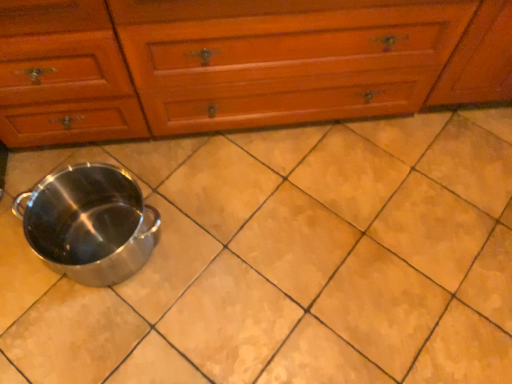
What do you see at coordinates (239, 63) in the screenshot?
I see `wooden chest of drawers at center` at bounding box center [239, 63].

I want to click on matte ceramic tile at center, so click(x=285, y=260).

Measure the distance between matte ceramic tile at center and camera.

matte ceramic tile at center and camera are 3.64 feet apart from each other.

You are a GUI agent. You are given a task and a screenshot of the screen. Output one action in this format:
    pyautogui.click(x=<x>, y=<y>)
    Task: Click on the satin silver crock pot at lower left
    Image resolution: width=512 pixels, height=384 pixels.
    Given the screenshot: What is the action you would take?
    pyautogui.click(x=89, y=223)

In order to click on wooden chest of drawers at center in this screenshot , I will do click(239, 63).

Where is `ceramic tile that is behind the satin silver crock pot at lower left`? This screenshot has width=512, height=384. ceramic tile that is behind the satin silver crock pot at lower left is located at coordinates (285, 260).

Considering their positions, is satin silver crock pot at lower left located in front of or behind matte ceramic tile at center?

satin silver crock pot at lower left is in front of matte ceramic tile at center.

Is satin silver crock pot at lower left touching matte ceramic tile at center?

No, satin silver crock pot at lower left is not beside matte ceramic tile at center.

From the image's perspective, is satin silver crock pot at lower left on matte ceramic tile at center?

Indeed, from the image's perspective, satin silver crock pot at lower left is shown above matte ceramic tile at center.

Are matte ceramic tile at center and wooden chest of drawers at center far apart?

Actually, matte ceramic tile at center and wooden chest of drawers at center are a little close together.

Which object is wider, matte ceramic tile at center or wooden chest of drawers at center?

Wider between the two is matte ceramic tile at center.

From the image's perspective, which one is positioned higher, matte ceramic tile at center or wooden chest of drawers at center?

wooden chest of drawers at center.

Consider the image. Measure the distance between matte ceramic tile at center and wooden chest of drawers at center.

matte ceramic tile at center is 15.73 inches from wooden chest of drawers at center.

Looking at this image, is wooden chest of drawers at center outside of matte ceramic tile at center?

Yes, wooden chest of drawers at center is located beyond the bounds of matte ceramic tile at center.

Can you confirm if wooden chest of drawers at center is bigger than matte ceramic tile at center?

Correct, wooden chest of drawers at center is larger in size than matte ceramic tile at center.

Is matte ceramic tile at center at the back of wooden chest of drawers at center?

No, matte ceramic tile at center is not at the back of wooden chest of drawers at center.

The image size is (512, 384). I want to click on ceramic tile that appears on the left of wooden chest of drawers at center, so click(285, 260).

Locate an element on the screen. This screenshot has width=512, height=384. the chest of drawers lying above the satin silver crock pot at lower left (from the image's perspective) is located at coordinates (239, 63).

Based on the photo, can you confirm if wooden chest of drawers at center is bigger than satin silver crock pot at lower left?

Yes.

From a real-world perspective, who is located lower, wooden chest of drawers at center or satin silver crock pot at lower left?

satin silver crock pot at lower left.

From a real-world perspective, is matte ceramic tile at center positioned under satin silver crock pot at lower left based on gravity?

Yes, from a real-world perspective, matte ceramic tile at center is under satin silver crock pot at lower left.

Are matte ceramic tile at center and satin silver crock pot at lower left making contact?

No, matte ceramic tile at center is not with satin silver crock pot at lower left.

From the image's perspective, relative to satin silver crock pot at lower left, is matte ceramic tile at center above or below?

From the image's perspective, matte ceramic tile at center appears below satin silver crock pot at lower left.

Is point (183, 259) farther from camera compared to point (111, 257)?

That is True.

Between satin silver crock pot at lower left and wooden chest of drawers at center, which one has more height?

With more height is wooden chest of drawers at center.

From a real-world perspective, is satin silver crock pot at lower left on wooden chest of drawers at center?

No, from a real-world perspective, satin silver crock pot at lower left is not on top of wooden chest of drawers at center.

Would you say wooden chest of drawers at center is part of satin silver crock pot at lower left's contents?

Definitely not — wooden chest of drawers at center is not inside satin silver crock pot at lower left.

Where is `crock pot above the matte ceramic tile at center (from a real-world perspective)`? crock pot above the matte ceramic tile at center (from a real-world perspective) is located at coordinates pos(89,223).

Image resolution: width=512 pixels, height=384 pixels. In order to click on ceramic tile behind the wooden chest of drawers at center in this screenshot , I will do `click(285, 260)`.

In the scene shown: Looking at the image, which one is located further to wooden chest of drawers at center, satin silver crock pot at lower left or matte ceramic tile at center?

Among the two, matte ceramic tile at center is located further to wooden chest of drawers at center.

Based on their spatial positions, is wooden chest of drawers at center or matte ceramic tile at center closer to satin silver crock pot at lower left?

Based on the image, matte ceramic tile at center appears to be nearer to satin silver crock pot at lower left.

Based on their spatial positions, is satin silver crock pot at lower left or wooden chest of drawers at center closer to matte ceramic tile at center?

The object closer to matte ceramic tile at center is satin silver crock pot at lower left.

Looking at the image, which one is located further to wooden chest of drawers at center, matte ceramic tile at center or satin silver crock pot at lower left?

matte ceramic tile at center lies further to wooden chest of drawers at center than the other object.

Considering their positions, is matte ceramic tile at center positioned closer to satin silver crock pot at lower left than wooden chest of drawers at center?

The object closer to satin silver crock pot at lower left is matte ceramic tile at center.

Estimate the real-world distances between objects in this image. Which object is further from matte ceramic tile at center, wooden chest of drawers at center or satin silver crock pot at lower left?

The object further to matte ceramic tile at center is wooden chest of drawers at center.

Identify the location of crock pot between wooden chest of drawers at center and matte ceramic tile at center in the up-down direction. (89, 223).